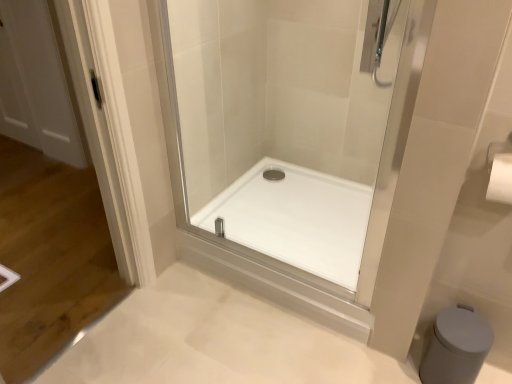
Question: Should I look upward or downward to see transparent glass shower door at center?

Choices:
 (A) up
 (B) down

Answer: (A)

Question: Can you confirm if white matte bidet at lower right is bigger than white glossy shower tray at center?

Choices:
 (A) no
 (B) yes

Answer: (A)

Question: Is white matte bidet at lower right in front of white glossy shower tray at center?

Choices:
 (A) yes
 (B) no

Answer: (A)

Question: From the image's perspective, is white matte bidet at lower right above white glossy shower tray at center?

Choices:
 (A) yes
 (B) no

Answer: (B)

Question: Is the position of white matte bidet at lower right more distant than that of white glossy shower tray at center?

Choices:
 (A) yes
 (B) no

Answer: (B)

Question: Considering the relative positions of white matte bidet at lower right and white glossy shower tray at center in the image provided, is white matte bidet at lower right to the right of white glossy shower tray at center from the viewer's perspective?

Choices:
 (A) no
 (B) yes

Answer: (B)

Question: From the image's perspective, is white matte bidet at lower right below white glossy shower tray at center?

Choices:
 (A) no
 (B) yes

Answer: (B)

Question: From the image's perspective, does white matte bidet at lower right appear lower than transparent glass shower door at center?

Choices:
 (A) no
 (B) yes

Answer: (B)

Question: From the image's perspective, is white matte bidet at lower right on transparent glass shower door at center?

Choices:
 (A) no
 (B) yes

Answer: (A)

Question: Considering the relative positions of white matte bidet at lower right and transparent glass shower door at center in the image provided, is white matte bidet at lower right to the left of transparent glass shower door at center from the viewer's perspective?

Choices:
 (A) yes
 (B) no

Answer: (B)

Question: Can you confirm if white matte bidet at lower right is taller than transparent glass shower door at center?

Choices:
 (A) yes
 (B) no

Answer: (B)

Question: Is white matte bidet at lower right positioned with its back to transparent glass shower door at center?

Choices:
 (A) yes
 (B) no

Answer: (B)

Question: Does white matte bidet at lower right have a larger size compared to transparent glass shower door at center?

Choices:
 (A) no
 (B) yes

Answer: (A)

Question: From the image's perspective, is transparent glass shower door at center beneath white matte bidet at lower right?

Choices:
 (A) no
 (B) yes

Answer: (A)